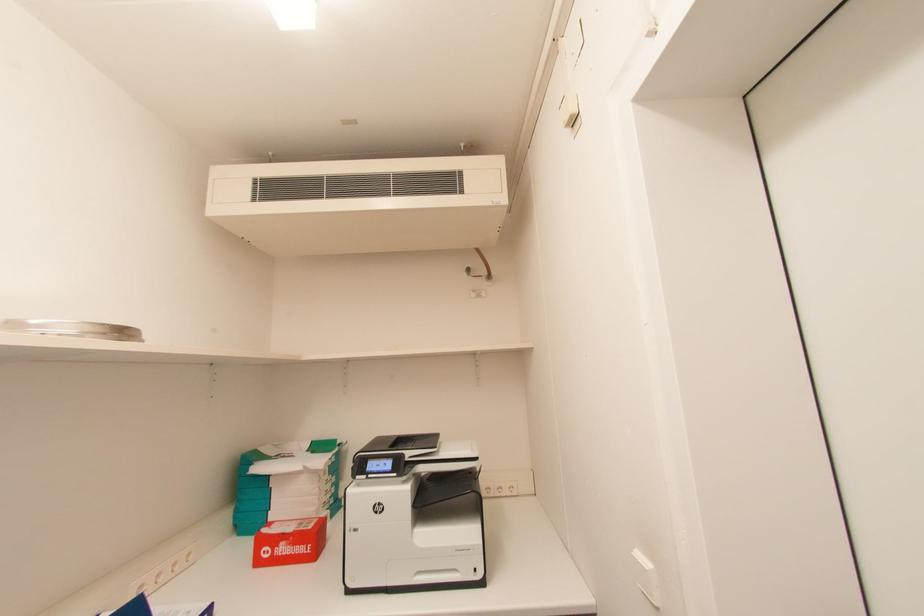
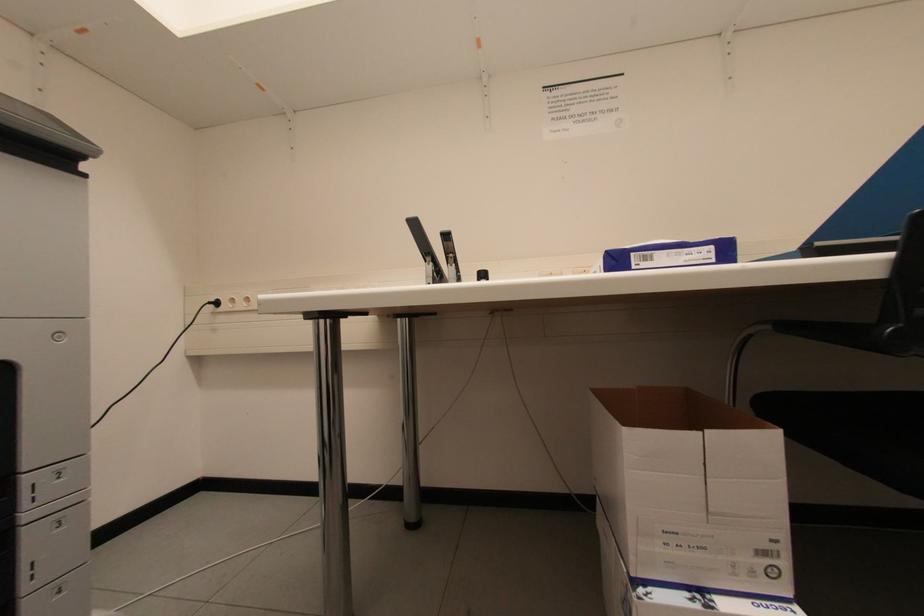
Question: The camera is either moving clockwise (left) or counter-clockwise (right) around the object. The first image is from the beginning of the video and the second image is from the end. Is the camera moving left or right when shooting the video?

Choices:
 (A) Left
 (B) Right

Answer: (B)